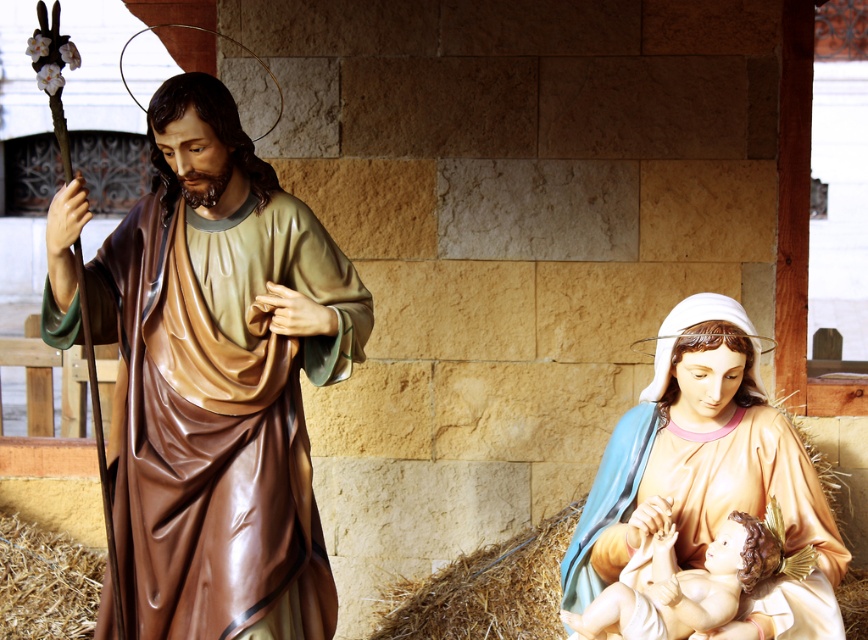
In the nativity scene, there is a brown glossy robe at left and a matte peach statue at lower right. Which object takes up more space in the image?

The brown glossy robe at left is larger in size than the matte peach statue at lower right, so it takes up more space in the image.

You are an art conservator assessing the spacing between the matte peach statue at lower right and the smooth porcelain baby at center. Based on their widths, could the statues potentially overlap if placed closer together?

The matte peach statue at lower right might be wider than the smooth porcelain baby at center, so there is a possibility of overlap if they are moved closer. Careful consideration of their dimensions is necessary to avoid collision.

In the nativity scene, you see a brown glossy robe at left and a smooth porcelain baby at center. Which object is located to the left of the other?

The brown glossy robe at left is positioned on the left side of smooth porcelain baby at center.